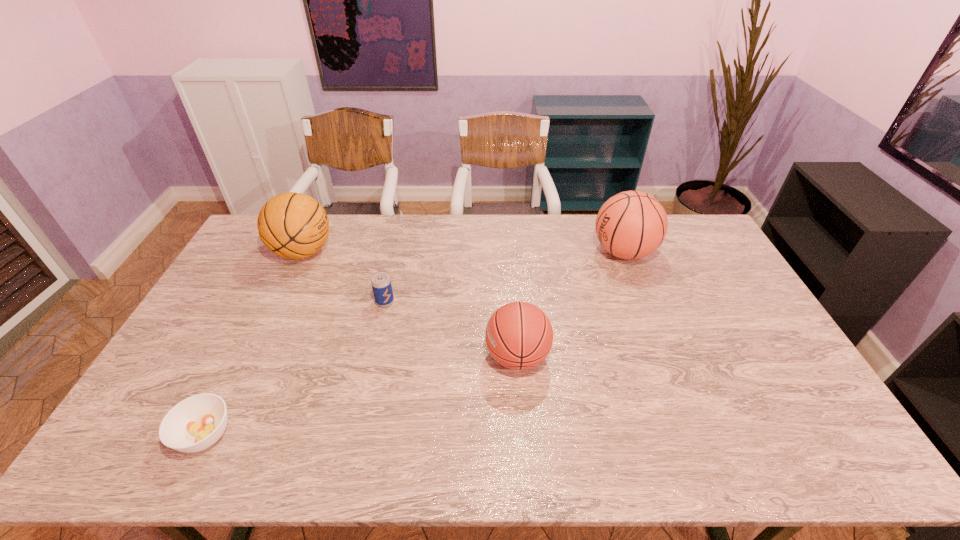
Identify the location of basketball that can be found as the closest to the nearest object. (293, 225).

The height and width of the screenshot is (540, 960). What are the coordinates of `vacant space that satisfies the following two spatial constraints: 1. on the surface of the leftmost basketball near the brand logo; 2. on the right side of the second shortest object` in the screenshot? It's located at (279, 302).

Locate an element on the screen. This screenshot has height=540, width=960. vacant space that satisfies the following two spatial constraints: 1. on the surface of the rightmost basketball near the brand logo; 2. on the front side of the shortest object is located at coordinates (694, 435).